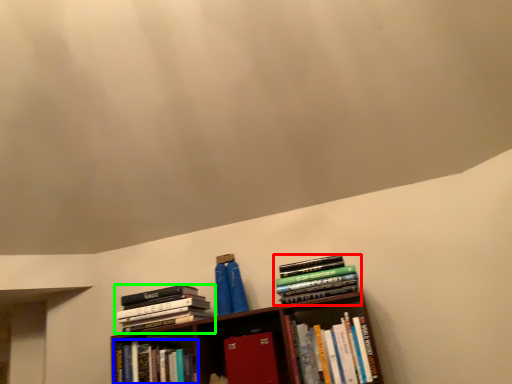
Question: Which object is positioned farthest from book (highlighted by a red box)? Select from book (highlighted by a blue box) and book (highlighted by a green box).

Choices:
 (A) book
 (B) book

Answer: (A)